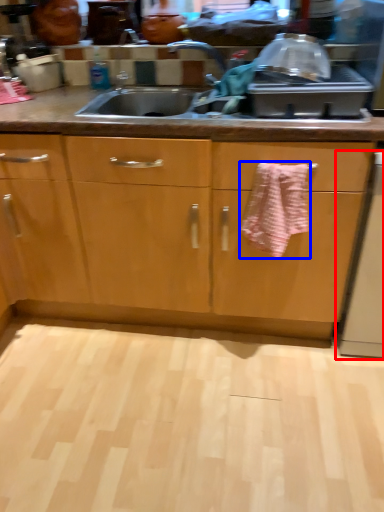
Question: Among these objects, which one is farthest to the camera, dish washer (highlighted by a red box) or bath towel (highlighted by a blue box)?

Choices:
 (A) dish washer
 (B) bath towel

Answer: (B)